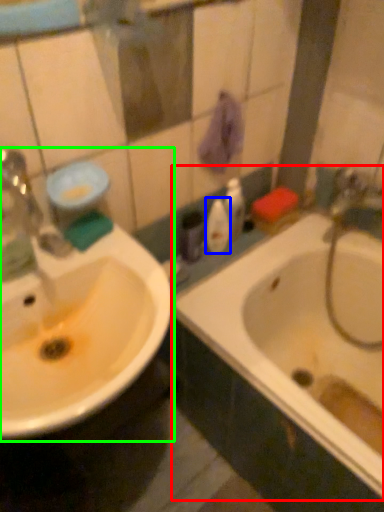
Question: Which is farther away from bathtub (highlighted by a red box)? mouthwash (highlighted by a blue box) or sink (highlighted by a green box)?

Choices:
 (A) mouthwash
 (B) sink

Answer: (B)